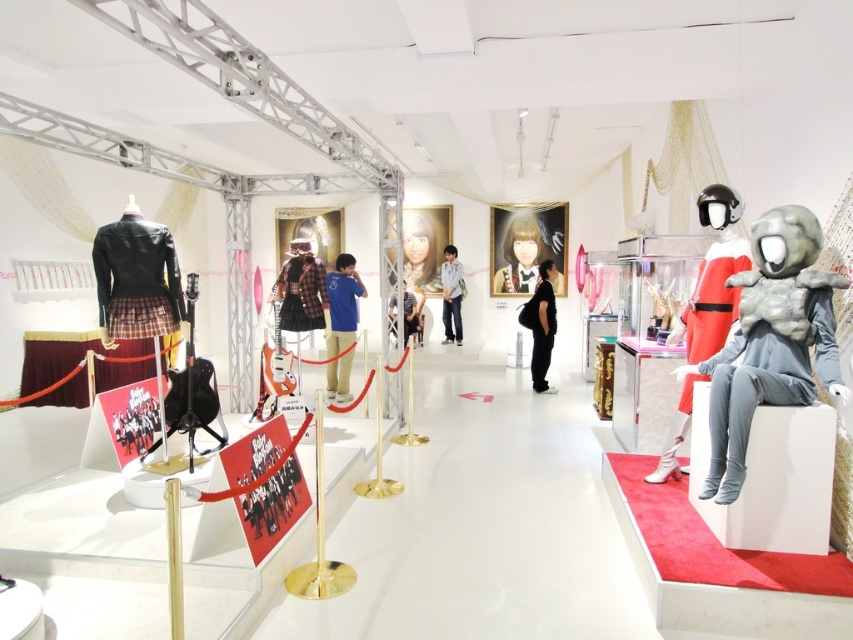
You are a visitor standing in the center of the exhibition space. You notice the plaid fabric skirt at center. Can you estimate its position relative to the center of the room using coordinates?

The plaid fabric skirt at center is located at coordinates approximately 0.455 on the x axis and 0.354 on the y axis.

You are a visitor at the exhibition and want to take a photo of both the plaid fabric skirt at center and the smooth glossy portrait at center. Can you fit both items in your camera frame if your camera has a maximum field of view of 6 meters? Please explain your reasoning.

The plaid fabric skirt at center and smooth glossy portrait at center are 5.64 meters apart. Since the distance between them is less than the camera field of view of 6 meters, both items can fit within the camera frame.

You are standing at the entrance of the exhibition hall and want to take a photo of the point marked at coordinates point (280, 317). Your camera has a maximum focus range of 20 feet. Will your camera be able to focus on the point?

The point (280, 317) is 19.96 feet from the camera, which is within the camera maximum focus range of 20 feet. Therefore, the camera can focus on the point.